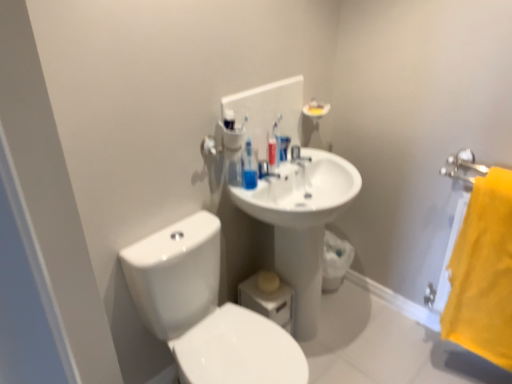
Question: Considering the relative sizes of translucent plastic toothbrushes at upper center and yellow fabric towel at right in the image provided, is translucent plastic toothbrushes at upper center thinner than yellow fabric towel at right?

Choices:
 (A) no
 (B) yes

Answer: (B)

Question: Is the surface of translucent plastic toothbrushes at upper center in direct contact with yellow fabric towel at right?

Choices:
 (A) yes
 (B) no

Answer: (B)

Question: Is translucent plastic toothbrushes at upper center shorter than yellow fabric towel at right?

Choices:
 (A) no
 (B) yes

Answer: (B)

Question: From a real-world perspective, does translucent plastic toothbrushes at upper center stand above yellow fabric towel at right?

Choices:
 (A) no
 (B) yes

Answer: (B)

Question: Can you confirm if translucent plastic toothbrushes at upper center is wider than yellow fabric towel at right?

Choices:
 (A) no
 (B) yes

Answer: (A)

Question: Is translucent plastic toothbrushes at upper center to the right of yellow fabric towel at right from the viewer's perspective?

Choices:
 (A) no
 (B) yes

Answer: (A)

Question: Is translucent plastic toothbrushes at upper center positioned behind white glossy sink at center?

Choices:
 (A) yes
 (B) no

Answer: (B)

Question: Is translucent plastic toothbrushes at upper center oriented away from white glossy sink at center?

Choices:
 (A) no
 (B) yes

Answer: (A)

Question: Can you confirm if translucent plastic toothbrushes at upper center is bigger than white glossy sink at center?

Choices:
 (A) yes
 (B) no

Answer: (A)

Question: Considering the relative sizes of translucent plastic toothbrushes at upper center and white glossy sink at center in the image provided, is translucent plastic toothbrushes at upper center thinner than white glossy sink at center?

Choices:
 (A) no
 (B) yes

Answer: (B)

Question: Are translucent plastic toothbrushes at upper center and white glossy sink at center beside each other?

Choices:
 (A) no
 (B) yes

Answer: (A)

Question: Is translucent plastic toothbrushes at upper center positioned in front of white glossy sink at center?

Choices:
 (A) no
 (B) yes

Answer: (B)

Question: From the image's perspective, would you say yellow fabric towel at right is positioned over translucent plastic toothbrushes at upper center?

Choices:
 (A) no
 (B) yes

Answer: (A)